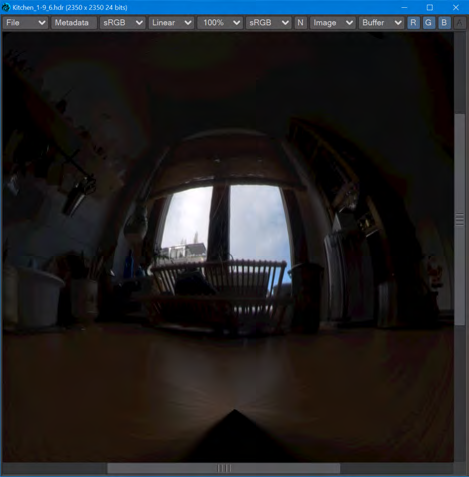
At what (x,y) coordinates should I click in order to perform the action: click on bin. Please return your answer as a coordinate pair (x, y). This screenshot has width=469, height=477. Looking at the image, I should click on [41, 298].